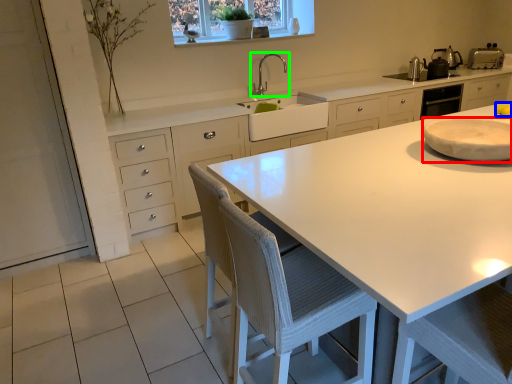
Question: Which is farther away from appliance (highlighted by a red box)? food (highlighted by a blue box) or tap (highlighted by a green box)?

Choices:
 (A) food
 (B) tap

Answer: (B)